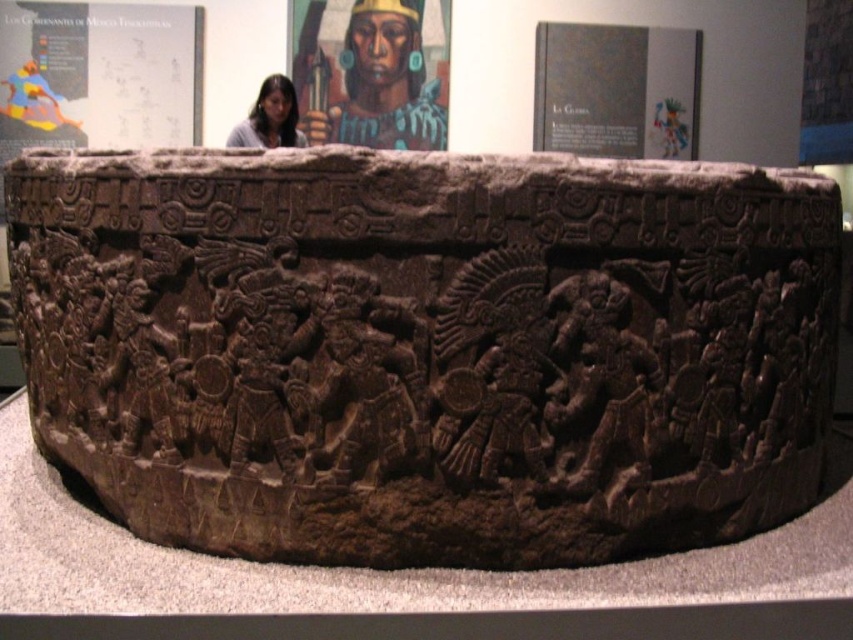
Based on the photo, you are a museum curator planning to install a protective glass cover over the brown carved stone at center. The glass must be positioned precisely to cover the entire artifact without extending beyond its edges. Based on the coordinates provided, what are the coordinates of the center point of the glass cover to ensure proper alignment?

The center point of the glass cover should be placed at the coordinates provided for the brown carved stone at center, which is at point (427, 348), to ensure it aligns perfectly with the artifact.

You are a museum curator planning to install a protective glass cover over the stone artifact. The point at coordinate (461, 548) on the artifact needs to be exactly centered under the glass. If the glass is 2.71 meters wide, will the entire artifact fit under the glass?

The distance between the two points is 2.71 meters. Since the glass is 2.71 meters wide, the entire artifact will just fit under the glass as long as the glass is positioned so that the point at coordinate (461, 548) is centered.

You are a museum visitor standing in front of the stone artifact. You notice the brown carved stone at center and the matte brown face at upper center. Which object is positioned to the right of the other?

The brown carved stone at center is to the right of the matte brown face at upper center.